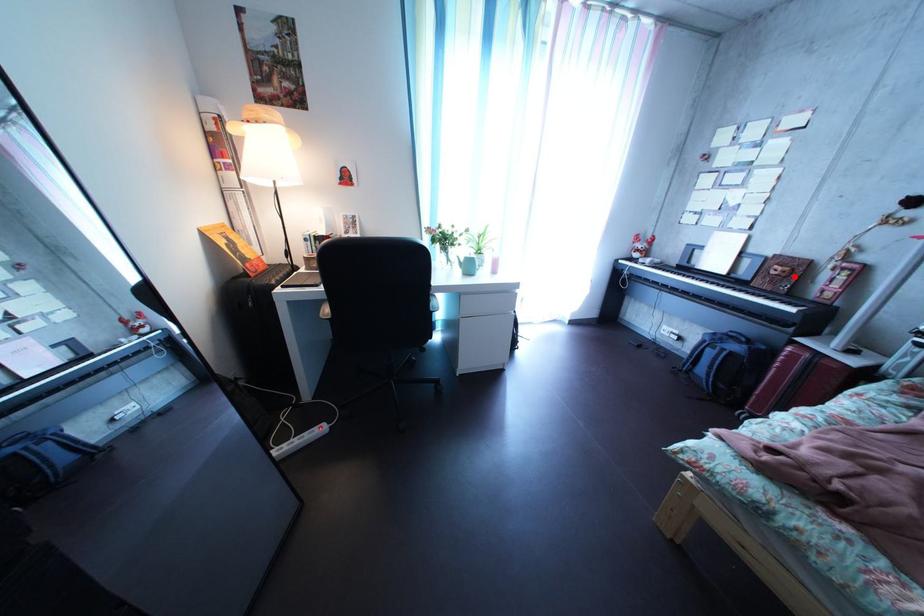
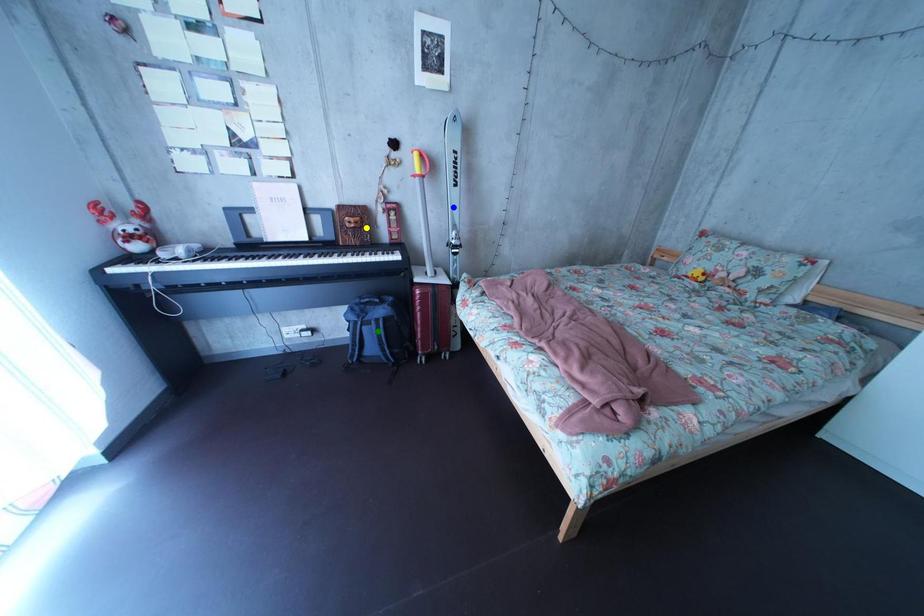
Question: I am providing you with two images of the same scene from different viewpoints. A red point is marked on the first image. You are given multiple points on the second image. In image 2, which mark is for the same physical point as the one in image 1?

Choices:
 (A) blue point
 (B) green point
 (C) yellow point

Answer: (C)